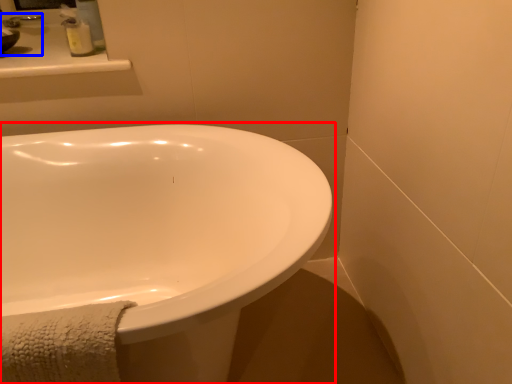
Question: Which of the following is the closest to the observer, bathtub (highlighted by a red box) or sink (highlighted by a blue box)?

Choices:
 (A) bathtub
 (B) sink

Answer: (A)